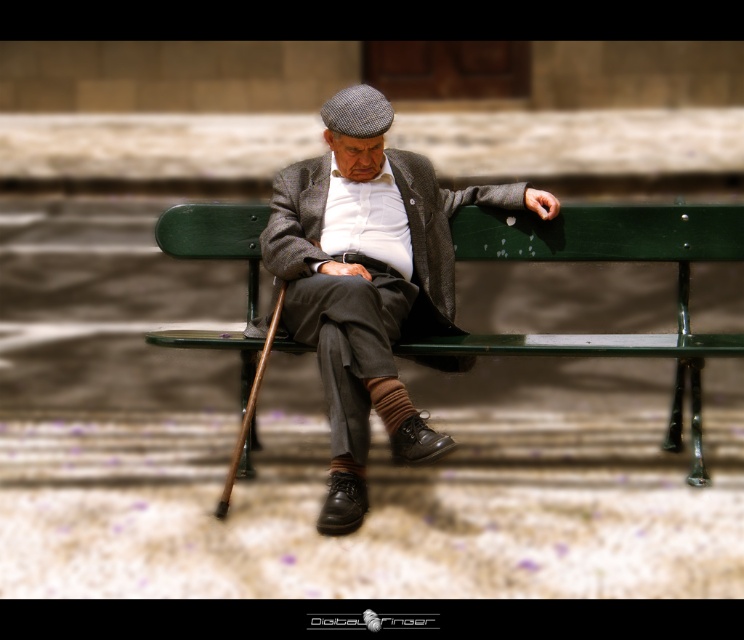
You are a passerby who notices the matte gray woolen coat at center on the bench. If you want to place a small bag next to it without moving the coat, where should you position the bag relative to the coat?

The matte gray woolen coat at center is located at point 0.496 on the horizontal axis. To place the bag next to it without moving the coat, position the bag slightly to the left or right along the bench at the same horizontal level.

Based on the photo, you are a passerby who wants to sit on the green painted wood park bench at center. Is there enough space for you to sit comfortably next to the matte gray woolen coat at center?

The matte gray woolen coat at center is located below green painted wood park bench at center, so it is hanging or placed under the bench. This means there should be enough space on the bench itself for you to sit comfortably next to where the coat is hanging.

Looking at this image, you are a tailor who needs to place a matte gray woolen coat at center on a green painted wood park bench at center. Can the coat fit entirely on the bench?

The matte gray woolen coat at center is narrower than the green painted wood park bench at center, so it can fit entirely on the bench.